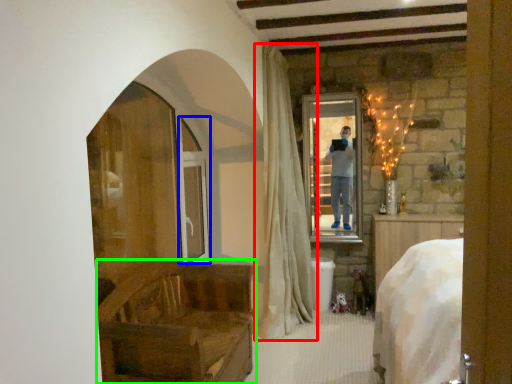
Question: Which is farther away from curtain (highlighted by a red box)? screen door (highlighted by a blue box) or furniture (highlighted by a green box)?

Choices:
 (A) screen door
 (B) furniture

Answer: (B)